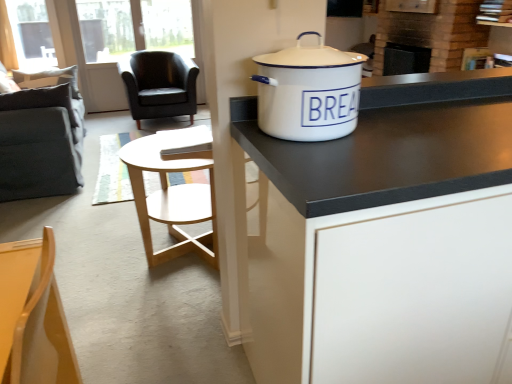
Consider the image. What is the approximate height of white enamel pot at upper right?

The height of white enamel pot at upper right is 9.87 inches.

This screenshot has width=512, height=384. I want to click on black matte cabinet at center, so click(x=384, y=237).

Image resolution: width=512 pixels, height=384 pixels. I want to click on transparent plastic window screen at upper left, so click(31, 33).

This screenshot has height=384, width=512. What are the coordinates of `black leather chair at upper left, the 2th chair when ordered from bottom to top` in the screenshot? It's located at (160, 85).

Choose the correct answer: Is black matte cabinet at center inside white enamel pot at upper right or outside it?

black matte cabinet at center exists outside the volume of white enamel pot at upper right.

Is black matte cabinet at center wider than white enamel pot at upper right?

Yes.

From a real-world perspective, is black matte cabinet at center on white enamel pot at upper right?

No, from a real-world perspective, black matte cabinet at center is not above white enamel pot at upper right.

Find the location of a particular element. Image resolution: width=512 pixels, height=384 pixels. cooker located above the black matte cabinet at center (from a real-world perspective) is located at coordinates (308, 92).

Is dark gray fabric swivel chair at left inside the boundaries of black matte cabinet at center, or outside?

The correct answer is: outside.

From the image's perspective, between dark gray fabric swivel chair at left and black matte cabinet at center, who is located below?

black matte cabinet at center, from the image's perspective.

Which object is positioned more to the right, dark gray fabric swivel chair at left or black matte cabinet at center?

black matte cabinet at center.

From a real-world perspective, is dark gray fabric swivel chair at left positioned over black matte cabinet at center based on gravity?

No.

From the image's perspective, which object appears higher, dark gray fabric swivel chair at left or black leather chair at upper left, the 1th chair from the left?

black leather chair at upper left, the 1th chair from the left, from the image's perspective.

Considering the positions of objects dark gray fabric swivel chair at left and black leather chair at upper left, the 1th chair from the left, in the image provided, who is more to the left, dark gray fabric swivel chair at left or black leather chair at upper left, the 1th chair from the left,?

dark gray fabric swivel chair at left.

From a real-world perspective, which is physically below, dark gray fabric swivel chair at left or black leather chair at upper left, arranged as the first chair when viewed from the top?

black leather chair at upper left, arranged as the first chair when viewed from the top, from a real-world perspective.

Considering the relative positions of dark gray fabric swivel chair at left and black leather chair at upper left, which is the 2th chair in right-to-left order, in the image provided, is dark gray fabric swivel chair at left behind black leather chair at upper left, which is the 2th chair in right-to-left order,?

No.

How far apart are white enamel pot at upper right and dark gray fabric swivel chair at left?

white enamel pot at upper right is 2.32 meters away from dark gray fabric swivel chair at left.

From a real-world perspective, is white enamel pot at upper right physically located above or below dark gray fabric swivel chair at left?

Clearly, from a real-world perspective, white enamel pot at upper right is above dark gray fabric swivel chair at left.

Is white enamel pot at upper right touching dark gray fabric swivel chair at left?

No, white enamel pot at upper right is not beside dark gray fabric swivel chair at left.

Considering the sizes of objects white enamel pot at upper right and dark gray fabric swivel chair at left in the image provided, who is taller, white enamel pot at upper right or dark gray fabric swivel chair at left?

Standing taller between the two is dark gray fabric swivel chair at left.

Is point (9, 312) farther from camera compared to point (371, 244)?

No.

In the scene shown: Are wooden chair at lower left, which ranks as the 1th chair in front-to-back order, and black matte cabinet at center making contact?

wooden chair at lower left, which ranks as the 1th chair in front-to-back order, is not next to black matte cabinet at center, and they're not touching.

From the picture: Is wooden chair at lower left, which is the 2th chair in top-to-bottom order, looking in the opposite direction of black matte cabinet at center?

Absolutely, wooden chair at lower left, which is the 2th chair in top-to-bottom order, is directed away from black matte cabinet at center.

How different are the orientations of black matte cabinet at center and black leather chair at upper left, the 1th chair from the left, in degrees?

8.92e-05 degrees separate the facing orientations of black matte cabinet at center and black leather chair at upper left, the 1th chair from the left.

Is black matte cabinet at center touching black leather chair at upper left, which is the 2th chair in right-to-left order?

black matte cabinet at center is not next to black leather chair at upper left, which is the 2th chair in right-to-left order, and they're not touching.

Who is more distant, black matte cabinet at center or black leather chair at upper left, the 2th chair when ordered from bottom to top?

black leather chair at upper left, the 2th chair when ordered from bottom to top, is further away from the camera.

Measure the distance between black matte cabinet at center and black leather chair at upper left, which is the 2th chair in right-to-left order.

They are 3.51 meters apart.

Would you say transparent plastic window screen at upper left is outside dark gray fabric swivel chair at left?

transparent plastic window screen at upper left is positioned outside dark gray fabric swivel chair at left.

Considering the sizes of objects transparent plastic window screen at upper left and dark gray fabric swivel chair at left in the image provided, who is taller, transparent plastic window screen at upper left or dark gray fabric swivel chair at left?

dark gray fabric swivel chair at left.

Which of these two, transparent plastic window screen at upper left or dark gray fabric swivel chair at left, is wider?

dark gray fabric swivel chair at left.

From a real-world perspective, which is physically below, transparent plastic window screen at upper left or dark gray fabric swivel chair at left?

From a 3D spatial view, dark gray fabric swivel chair at left is below.

Where is `cooker above the black matte cabinet at center (from the image's perspective)`? The image size is (512, 384). cooker above the black matte cabinet at center (from the image's perspective) is located at coordinates (308, 92).

Locate an element on the screen. cabinetry that is below the dark gray fabric swivel chair at left (from the image's perspective) is located at coordinates (384, 237).

From the image, which object appears to be nearer to black leather chair at upper left, arranged as the first chair when viewed from the top, transparent plastic window screen at upper left or wooden chair at lower left, which ranks as the 1th chair in front-to-back order?

transparent plastic window screen at upper left is closer to black leather chair at upper left, arranged as the first chair when viewed from the top.

Based on their spatial positions, is dark gray fabric swivel chair at left or white enamel pot at upper right further from wooden chair at lower left, which is the 2th chair in top-to-bottom order?

dark gray fabric swivel chair at left.

When comparing their distances from dark gray fabric swivel chair at left, does wooden chair at lower left, the second chair when ordered from left to right, or white enamel pot at upper right seem further?

The object further to dark gray fabric swivel chair at left is white enamel pot at upper right.

Based on their spatial positions, is white enamel pot at upper right or dark gray fabric swivel chair at left further from wooden chair at lower left, acting as the 2th chair starting from the back?

Among the two, dark gray fabric swivel chair at left is located further to wooden chair at lower left, acting as the 2th chair starting from the back.

Looking at the image, which one is located closer to transparent plastic window screen at upper left, black leather chair at upper left, the 1th chair from the left, or black matte cabinet at center?

black leather chair at upper left, the 1th chair from the left, lies closer to transparent plastic window screen at upper left than the other object.

Considering their positions, is dark gray fabric swivel chair at left positioned closer to wooden chair at lower left, acting as the 2th chair starting from the back, than transparent plastic window screen at upper left?

Among the two, dark gray fabric swivel chair at left is located nearer to wooden chair at lower left, acting as the 2th chair starting from the back.

Considering their positions, is wooden chair at lower left, acting as the 2th chair starting from the back, positioned further to black leather chair at upper left, placed as the first chair when sorted from back to front, than white enamel pot at upper right?

Based on the image, wooden chair at lower left, acting as the 2th chair starting from the back, appears to be further to black leather chair at upper left, placed as the first chair when sorted from back to front.

From the image, which object appears to be farther from white enamel pot at upper right, wooden chair at lower left, the 1th chair from the bottom, or transparent plastic window screen at upper left?

transparent plastic window screen at upper left is positioned further to the anchor white enamel pot at upper right.

Image resolution: width=512 pixels, height=384 pixels. What are the coordinates of `chair between white enamel pot at upper right and transparent plastic window screen at upper left along the z-axis` in the screenshot? It's located at (160, 85).

Identify the location of cooker located between wooden chair at lower left, marked as the 1th chair in a right-to-left arrangement, and transparent plastic window screen at upper left in the depth direction. The height and width of the screenshot is (384, 512). (308, 92).

Identify the location of cooker located between wooden chair at lower left, which ranks as the 1th chair in front-to-back order, and black matte cabinet at center in the left-right direction. (308, 92).

The image size is (512, 384). I want to click on swivel chair located between black matte cabinet at center and transparent plastic window screen at upper left in the depth direction, so click(x=42, y=138).